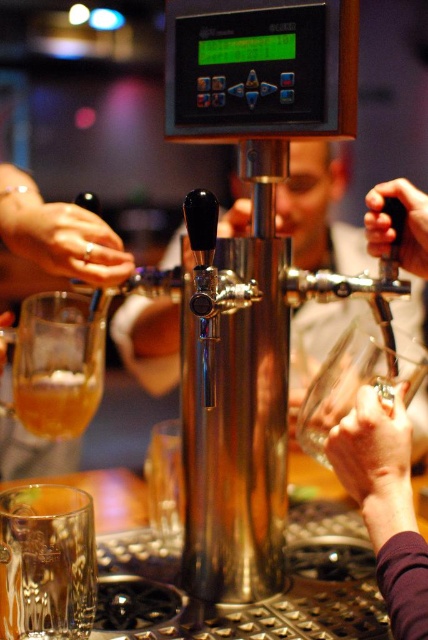
Which is more to the left, purple fabric hand at lower right or translucent amber glass at lower left?

translucent amber glass at lower left

Is purple fabric hand at lower right taller than translucent amber glass at lower left?

Incorrect, purple fabric hand at lower right's height is not larger of translucent amber glass at lower left's.

Locate an element on the screen. purple fabric hand at lower right is located at coordinates (385, 502).

You are a GUI agent. You are given a task and a screenshot of the screen. Output one action in this format:
    pyautogui.click(x=<x>, y=<y>)
    Task: Click on the purple fabric hand at lower right
    
    Given the screenshot: What is the action you would take?
    pyautogui.click(x=385, y=502)